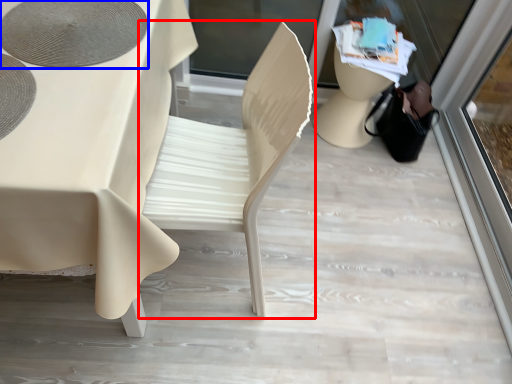
Question: Which object appears farthest to the camera in this image, chair (highlighted by a red box) or oval (highlighted by a blue box)?

Choices:
 (A) chair
 (B) oval

Answer: (B)